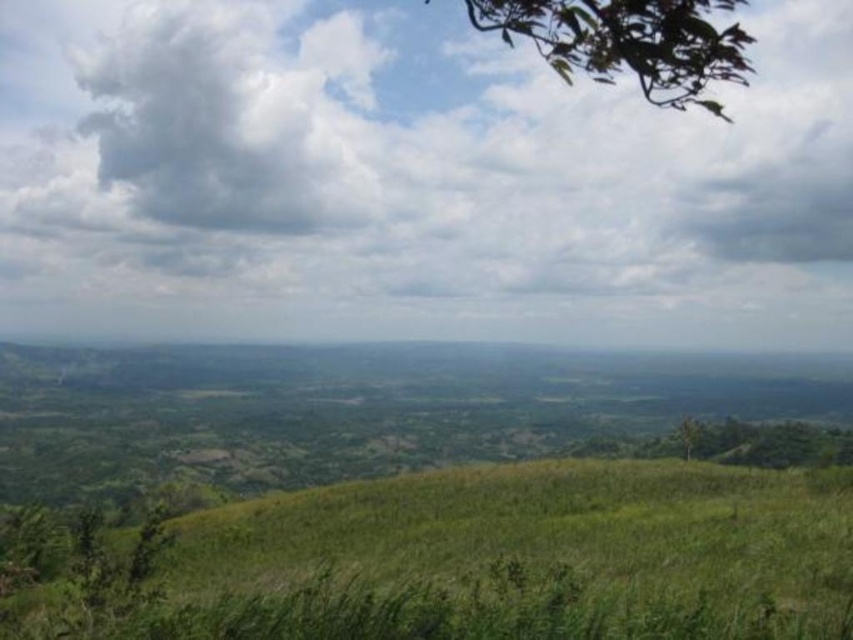
In the scene shown: You are standing on the grassy hillside in the foreground of the image and want to look up at the white fluffy cloud at upper center. What are the exact coordinates where you should look?

The white fluffy cloud at upper center is located at coordinates point (412,180).

You are standing on the grassy hillside in the foreground of the image. Looking up, you notice a point marked at coordinates (x=412, y=180). What object is located at that point?

The point at coordinates (x=412, y=180) indicates a white fluffy cloud at upper center.